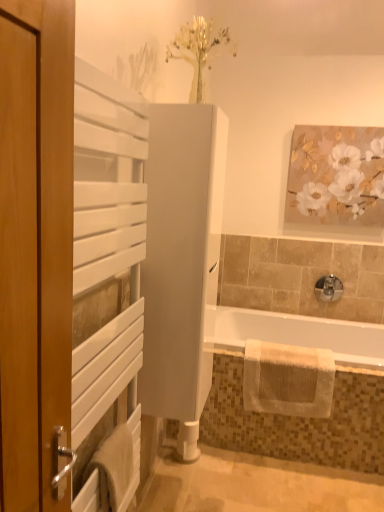
Question: From the image's perspective, is white glossy tub at lower right under white matte radiator at left, the 2th screen door positioned from the back?

Choices:
 (A) yes
 (B) no

Answer: (A)

Question: Can you confirm if white glossy tub at lower right is smaller than white matte radiator at left, the 2th screen door positioned from the back?

Choices:
 (A) yes
 (B) no

Answer: (B)

Question: Considering the relative sizes of white glossy tub at lower right and white matte radiator at left, which is the first screen door in front-to-back order, in the image provided, is white glossy tub at lower right taller than white matte radiator at left, which is the first screen door in front-to-back order,?

Choices:
 (A) yes
 (B) no

Answer: (B)

Question: Is white glossy tub at lower right shorter than white matte radiator at left, the 2th screen door positioned from the back?

Choices:
 (A) yes
 (B) no

Answer: (A)

Question: Is white glossy tub at lower right looking in the opposite direction of white matte radiator at left, the 2th screen door positioned from the back?

Choices:
 (A) yes
 (B) no

Answer: (B)

Question: In the image, is white textured towel at lower right, placed as the 2th bath towel when sorted from front to back, positioned in front of or behind white matte radiator at left, the 2th screen door positioned from the back?

Choices:
 (A) behind
 (B) front

Answer: (A)

Question: Is point 331,404 closer or farther from the camera than point 127,199?

Choices:
 (A) closer
 (B) farther

Answer: (B)

Question: From the image's perspective, is white textured towel at lower right, placed as the 1th bath towel when sorted from right to left, above or below white matte radiator at left, the 2th screen door positioned from the back?

Choices:
 (A) above
 (B) below

Answer: (B)

Question: Is white textured towel at lower right, which appears as the 2th bath towel when viewed from the left, inside the boundaries of white matte radiator at left, which is the first screen door in front-to-back order, or outside?

Choices:
 (A) outside
 (B) inside

Answer: (A)

Question: Based on their positions, is white textured towel at lower left, the 2th bath towel in the right-to-left sequence, located to the left or right of white glossy tub at lower right?

Choices:
 (A) right
 (B) left

Answer: (B)

Question: From the image's perspective, is white textured towel at lower left, the 2th bath towel in the right-to-left sequence, positioned above or below white glossy tub at lower right?

Choices:
 (A) above
 (B) below

Answer: (B)

Question: Do you think white textured towel at lower left, which ranks as the 1th bath towel in left-to-right order, is within white glossy tub at lower right, or outside of it?

Choices:
 (A) outside
 (B) inside

Answer: (A)

Question: Is white textured towel at lower left, the 2th bath towel when ordered from back to front, taller or shorter than white glossy tub at lower right?

Choices:
 (A) short
 (B) tall

Answer: (A)

Question: In the image, is white matte cabinet at center, which is the second screen door in front-to-back order, on the left side or the right side of white textured towel at lower left, the 2th bath towel when ordered from back to front?

Choices:
 (A) right
 (B) left

Answer: (A)

Question: Does point (223, 126) appear closer or farther from the camera than point (127, 440)?

Choices:
 (A) farther
 (B) closer

Answer: (A)